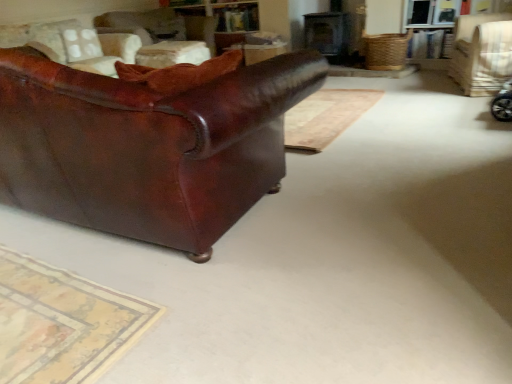
You are a GUI agent. You are given a task and a screenshot of the screen. Output one action in this format:
    pyautogui.click(x=<x>, y=<y>)
    Task: Click on the leather couch at left, the 3th chair when ordered from right to left
    
    Given the screenshot: What is the action you would take?
    pyautogui.click(x=73, y=45)

What do you see at coordinates (482, 53) in the screenshot?
I see `light beige fabric chair at upper right, which appears as the 3th chair when viewed from the left` at bounding box center [482, 53].

This screenshot has height=384, width=512. What do you see at coordinates (149, 143) in the screenshot? I see `shiny brown leather couch at left` at bounding box center [149, 143].

Where is `leather couch at left, which appears as the first chair when viewed from the left`? Image resolution: width=512 pixels, height=384 pixels. leather couch at left, which appears as the first chair when viewed from the left is located at coordinates (73, 45).

Does point (153, 32) come behind point (298, 81)?

Yes, point (153, 32) is behind point (298, 81).

Considering the relative sizes of leather couch at upper left, the second chair positioned from the right, and shiny brown leather couch at left in the image provided, is leather couch at upper left, the second chair positioned from the right, wider than shiny brown leather couch at left?

No.

How far apart are leather couch at upper left, the second chair positioned from the right, and shiny brown leather couch at left?

A distance of 2.94 meters exists between leather couch at upper left, the second chair positioned from the right, and shiny brown leather couch at left.

Considering the relative sizes of leather couch at upper left, the second chair positioned from the right, and shiny brown leather couch at left in the image provided, is leather couch at upper left, the second chair positioned from the right, taller than shiny brown leather couch at left?

Incorrect, the height of leather couch at upper left, the second chair positioned from the right, is not larger of that of shiny brown leather couch at left.

Is wooden table at center turned away from shiny brown leather couch at left?

That's not correct — wooden table at center is not looking away from shiny brown leather couch at left.

Is wooden table at center placed right next to shiny brown leather couch at left?

No, wooden table at center is not touching shiny brown leather couch at left.

Can we say wooden table at center lies outside shiny brown leather couch at left?

wooden table at center lies outside shiny brown leather couch at left's area.

Does wooden table at center have a greater height compared to shiny brown leather couch at left?

Incorrect, the height of wooden table at center is not larger of that of shiny brown leather couch at left.

Who is taller, wooden table at center or leather couch at left, the 3th chair when ordered from right to left?

With more height is leather couch at left, the 3th chair when ordered from right to left.

Is point (184, 57) farther from camera compared to point (84, 32)?

No, (184, 57) is closer to viewer.

Based on their positions, is wooden table at center located to the left or right of leather couch at left, the 3th chair when ordered from right to left?

wooden table at center is to the right of leather couch at left, the 3th chair when ordered from right to left.

Is wooden table at center thinner than leather couch at left, which appears as the first chair when viewed from the left?

Yes, wooden table at center is thinner than leather couch at left, which appears as the first chair when viewed from the left.

Is leather couch at left, the 3th chair when ordered from right to left, oriented towards shiny brown leather couch at left?

Yes, leather couch at left, the 3th chair when ordered from right to left, is turned towards shiny brown leather couch at left.

Is leather couch at left, which appears as the first chair when viewed from the left, in contact with shiny brown leather couch at left?

No, leather couch at left, which appears as the first chair when viewed from the left, is not making contact with shiny brown leather couch at left.

Based on the photo, is leather couch at left, which appears as the first chair when viewed from the left, at the left side of shiny brown leather couch at left?

Correct, you'll find leather couch at left, which appears as the first chair when viewed from the left, to the left of shiny brown leather couch at left.

Which point is more distant from viewer, (123, 56) or (108, 178)?

Point (123, 56)

This screenshot has width=512, height=384. I want to click on table that appears on the left of light beige fabric chair at upper right, which appears as the 3th chair when viewed from the left, so click(x=172, y=53).

From the image's perspective, relative to light beige fabric chair at upper right, which appears as the 3th chair when viewed from the left, is wooden table at center above or below?

wooden table at center is situated higher than light beige fabric chair at upper right, which appears as the 3th chair when viewed from the left, in the image.

Can you confirm if wooden table at center is shorter than light beige fabric chair at upper right, which is the 1th chair in right-to-left order?

Yes.

Considering the relative positions of light beige fabric chair at upper right, which appears as the 3th chair when viewed from the left, and leather couch at upper left, the second chair positioned from the right, in the image provided, is light beige fabric chair at upper right, which appears as the 3th chair when viewed from the left, behind leather couch at upper left, the second chair positioned from the right,?

No, the depth of light beige fabric chair at upper right, which appears as the 3th chair when viewed from the left, is less than that of leather couch at upper left, the second chair positioned from the right.

How much distance is there between light beige fabric chair at upper right, which is the 1th chair in right-to-left order, and leather couch at upper left, which is the second chair from left to right?

light beige fabric chair at upper right, which is the 1th chair in right-to-left order, and leather couch at upper left, which is the second chair from left to right, are 9.28 feet apart.

This screenshot has height=384, width=512. I want to click on chair that is under the leather couch at upper left, the second chair positioned from the right (from a real-world perspective), so click(x=482, y=53).

Does light beige fabric chair at upper right, which appears as the 3th chair when viewed from the left, touch leather couch at upper left, which is the second chair from left to right?

No, light beige fabric chair at upper right, which appears as the 3th chair when viewed from the left, is not with leather couch at upper left, which is the second chair from left to right.

Who is more distant, shiny brown leather couch at left or wooden table at center?

wooden table at center.

Who is smaller, shiny brown leather couch at left or wooden table at center?

wooden table at center is smaller.

Considering the sizes of shiny brown leather couch at left and wooden table at center in the image, is shiny brown leather couch at left wider or thinner than wooden table at center?

Clearly, shiny brown leather couch at left has more width compared to wooden table at center.

From a real-world perspective, is shiny brown leather couch at left physically below wooden table at center?

Incorrect, from a real-world perspective, shiny brown leather couch at left is higher than wooden table at center.

The width and height of the screenshot is (512, 384). There is a shiny brown leather couch at left. Identify the location of the 3rd chair above it (from the image's perspective). (163, 35).

Locate an element on the screen. The width and height of the screenshot is (512, 384). table on the left of the shiny brown leather couch at left is located at coordinates (172, 53).

Considering their positions, is leather couch at left, which appears as the first chair when viewed from the left, positioned further to light beige fabric chair at upper right, which appears as the 3th chair when viewed from the left, than shiny brown leather couch at left?

leather couch at left, which appears as the first chair when viewed from the left, is positioned further to the anchor light beige fabric chair at upper right, which appears as the 3th chair when viewed from the left.

When comparing their distances from leather couch at left, the 3th chair when ordered from right to left, does wooden table at center or leather couch at upper left, the second chair positioned from the right, seem closer?

Among the two, leather couch at upper left, the second chair positioned from the right, is located nearer to leather couch at left, the 3th chair when ordered from right to left.

Based on their spatial positions, is shiny brown leather couch at left or light beige fabric chair at upper right, which is the 1th chair in right-to-left order, closer to wooden table at center?

light beige fabric chair at upper right, which is the 1th chair in right-to-left order, lies closer to wooden table at center than the other object.

From the picture: From the image, which object appears to be farther from shiny brown leather couch at left, leather couch at left, which appears as the first chair when viewed from the left, or leather couch at upper left, which is the second chair from left to right?

Based on the image, leather couch at upper left, which is the second chair from left to right, appears to be further to shiny brown leather couch at left.

When comparing their distances from leather couch at upper left, which is the second chair from left to right, does light beige fabric chair at upper right, which appears as the 3th chair when viewed from the left, or shiny brown leather couch at left seem further?

The object further to leather couch at upper left, which is the second chair from left to right, is shiny brown leather couch at left.

Which object lies nearer to the anchor point light beige fabric chair at upper right, which is the 1th chair in right-to-left order, shiny brown leather couch at left or leather couch at left, the 3th chair when ordered from right to left?

shiny brown leather couch at left lies closer to light beige fabric chair at upper right, which is the 1th chair in right-to-left order, than the other object.

Based on the photo, looking at the image, which one is located closer to wooden table at center, light beige fabric chair at upper right, which appears as the 3th chair when viewed from the left, or shiny brown leather couch at left?

light beige fabric chair at upper right, which appears as the 3th chair when viewed from the left.

Estimate the real-world distances between objects in this image. Which object is closer to light beige fabric chair at upper right, which appears as the 3th chair when viewed from the left, shiny brown leather couch at left or leather couch at upper left, which is the second chair from left to right?

The object closer to light beige fabric chair at upper right, which appears as the 3th chair when viewed from the left, is leather couch at upper left, which is the second chair from left to right.

At what (x,y) coordinates should I click in order to perform the action: click on studio couch situated between wooden table at center and light beige fabric chair at upper right, which is the 1th chair in right-to-left order, from left to right. Please return your answer as a coordinate pair (x, y). Looking at the image, I should click on (149, 143).

Locate an element on the screen. table between leather couch at upper left, which is the second chair from left to right, and light beige fabric chair at upper right, which is the 1th chair in right-to-left order, in the horizontal direction is located at coordinates (172, 53).

Where is `studio couch between leather couch at upper left, the second chair positioned from the right, and light beige fabric chair at upper right, which appears as the 3th chair when viewed from the left`? The image size is (512, 384). studio couch between leather couch at upper left, the second chair positioned from the right, and light beige fabric chair at upper right, which appears as the 3th chair when viewed from the left is located at coordinates click(149, 143).

At what (x,y) coordinates should I click in order to perform the action: click on table located between shiny brown leather couch at left and leather couch at upper left, the second chair positioned from the right, in the depth direction. Please return your answer as a coordinate pair (x, y). This screenshot has height=384, width=512. Looking at the image, I should click on (172, 53).